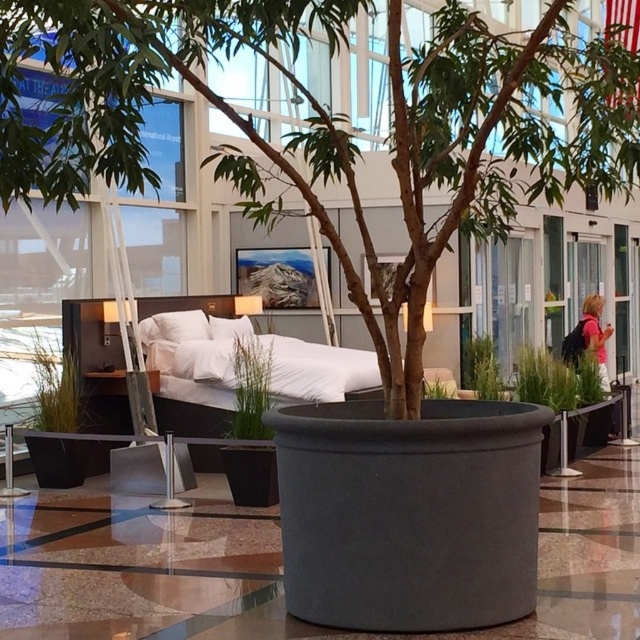
This screenshot has width=640, height=640. Describe the element at coordinates (192, 381) in the screenshot. I see `white fabric bed at center` at that location.

Find the location of a particular element. The image size is (640, 640). white fabric bed at center is located at coordinates (192, 381).

Where is `white fabric bed at center`? Image resolution: width=640 pixels, height=640 pixels. white fabric bed at center is located at coordinates (192, 381).

Where is `white fabric bed at center`? white fabric bed at center is located at coordinates (192, 381).

Which is below, brown matte tree at center or white fabric bed at center?

Positioned lower is white fabric bed at center.

The width and height of the screenshot is (640, 640). In order to click on brown matte tree at center in this screenshot , I will do `click(333, 124)`.

Find the location of a particular element. The image size is (640, 640). brown matte tree at center is located at coordinates (333, 124).

Which is behind, point (426, 92) or point (161, 330)?

The point (161, 330) is more distant.

Is point (600, 150) in front of point (202, 336)?

Yes.

Describe the element at coordinates (333, 124) in the screenshot. Image resolution: width=640 pixels, height=640 pixels. I see `brown matte tree at center` at that location.

At what (x,y) coordinates should I click in order to perform the action: click on brown matte tree at center. Please return your answer as a coordinate pair (x, y). Looking at the image, I should click on (333, 124).